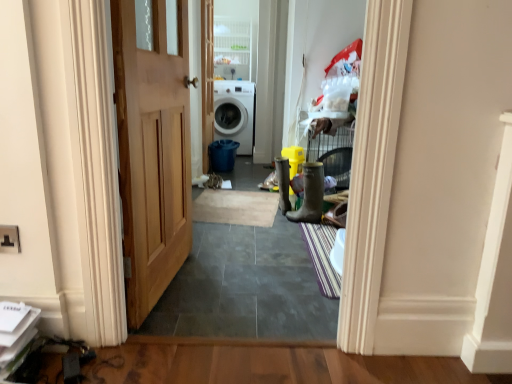
Question: Should I look upward or downward to see rubber boot at center, placed as the 1th boot when sorted from left to right?

Choices:
 (A) down
 (B) up

Answer: (B)

Question: From a real-world perspective, is white glossy washing machine at center beneath white plastic cabinet at upper center?

Choices:
 (A) yes
 (B) no

Answer: (A)

Question: Is white glossy washing machine at center in front of white plastic cabinet at upper center?

Choices:
 (A) yes
 (B) no

Answer: (B)

Question: Is white glossy washing machine at center positioned with its back to white plastic cabinet at upper center?

Choices:
 (A) no
 (B) yes

Answer: (A)

Question: Can you confirm if white glossy washing machine at center is positioned to the right of white plastic cabinet at upper center?

Choices:
 (A) yes
 (B) no

Answer: (B)

Question: Can you confirm if white glossy washing machine at center is bigger than white plastic cabinet at upper center?

Choices:
 (A) yes
 (B) no

Answer: (A)

Question: Can we say white glossy washing machine at center lies outside white plastic cabinet at upper center?

Choices:
 (A) yes
 (B) no

Answer: (A)

Question: From the image's perspective, is beige carpet at center, which is the 2th doormat in front-to-back order, on top of rubber/matte boot at right, which is the first boot from front to back?

Choices:
 (A) yes
 (B) no

Answer: (B)

Question: Can you confirm if beige carpet at center, the second doormat positioned from the bottom, is smaller than rubber/matte boot at right, which is counted as the second boot, starting from the back?

Choices:
 (A) no
 (B) yes

Answer: (B)

Question: Does beige carpet at center, the second doormat positioned from the bottom, come behind rubber/matte boot at right, which is counted as the second boot, starting from the back?

Choices:
 (A) yes
 (B) no

Answer: (A)

Question: Considering the relative sizes of beige carpet at center, acting as the 1th doormat starting from the back, and rubber/matte boot at right, which is the first boot from front to back, in the image provided, is beige carpet at center, acting as the 1th doormat starting from the back, thinner than rubber/matte boot at right, which is the first boot from front to back,?

Choices:
 (A) no
 (B) yes

Answer: (A)

Question: From a real-world perspective, does beige carpet at center, marked as the first doormat in a top-to-bottom arrangement, stand above rubber/matte boot at right, the first boot when ordered from right to left?

Choices:
 (A) no
 (B) yes

Answer: (A)

Question: Considering the relative positions of beige carpet at center, which is the 2th doormat in front-to-back order, and rubber/matte boot at right, which is the first boot from front to back, in the image provided, is beige carpet at center, which is the 2th doormat in front-to-back order, to the left of rubber/matte boot at right, which is the first boot from front to back, from the viewer's perspective?

Choices:
 (A) yes
 (B) no

Answer: (A)

Question: Considering the relative sizes of rubber boot at center, the first boot in the back-to-front sequence, and beige carpet at center, the second doormat positioned from the bottom, in the image provided, is rubber boot at center, the first boot in the back-to-front sequence, bigger than beige carpet at center, the second doormat positioned from the bottom,?

Choices:
 (A) yes
 (B) no

Answer: (A)